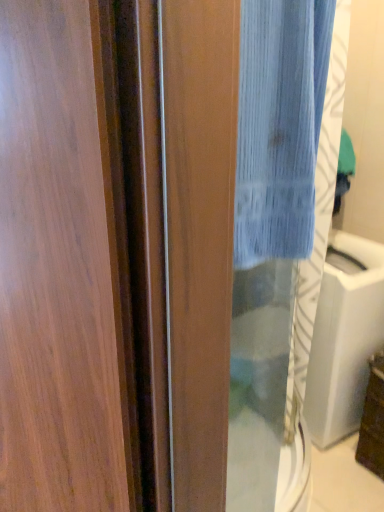
Locate an element on the screen. transparent glass sink at center is located at coordinates (344, 337).

Is there a large distance between wooden screen door at left and blue textured fabric at center?

No, there isn't a large distance between wooden screen door at left and blue textured fabric at center.

Can you confirm if wooden screen door at left is shorter than blue textured fabric at center?

In fact, wooden screen door at left may be taller than blue textured fabric at center.

Which is behind, point (322, 193) or point (274, 45)?

The point (322, 193) is farther from the camera.

From the image's perspective, is blue textured fabric at center on wooden screen door at left?

Yes.

In terms of width, does blue textured fabric at center look wider or thinner when compared to wooden screen door at left?

In the image, blue textured fabric at center appears to be more narrow than wooden screen door at left.

From a real-world perspective, which object rests below the other?

wooden screen door at left, from a real-world perspective.

Does blue textured fabric at center have a smaller size compared to wooden screen door at left?

Yes.

From the image's perspective, is transparent glass sink at center beneath blue textured fabric at center?

Yes, from the image's perspective, transparent glass sink at center is beneath blue textured fabric at center.

Does transparent glass sink at center have a smaller size compared to blue textured fabric at center?

No, transparent glass sink at center is not smaller than blue textured fabric at center.

Can you confirm if transparent glass sink at center is shorter than blue textured fabric at center?

No.

This screenshot has height=512, width=384. In the image, there is a blue textured fabric at center. In order to click on sink below it (from the image's perspective) in this screenshot , I will do `click(344, 337)`.

Would you say blue textured fabric at center is a long distance from transparent glass sink at center?

That's not correct — blue textured fabric at center is a little close to transparent glass sink at center.

Between blue textured fabric at center and transparent glass sink at center, which one appears on the right side from the viewer's perspective?

transparent glass sink at center is more to the right.

Are wooden screen door at left and transparent glass sink at center making contact?

No, wooden screen door at left is not with transparent glass sink at center.

Considering the relative positions of wooden screen door at left and transparent glass sink at center in the image provided, is wooden screen door at left to the left of transparent glass sink at center from the viewer's perspective?

Yes.

What's the angular difference between transparent glass sink at center and wooden screen door at left's facing directions?

7.71 degrees separate the facing orientations of transparent glass sink at center and wooden screen door at left.

Is transparent glass sink at center looking in the opposite direction of wooden screen door at left?

transparent glass sink at center is not turned away from wooden screen door at left.

Is point (313, 393) farther from camera compared to point (199, 329)?

Yes, it is.

Find the location of a particular element. This screenshot has width=384, height=512. screen door on the left of the transparent glass sink at center is located at coordinates (245, 239).

Where is `curtain on the right of the wooden screen door at left`? This screenshot has width=384, height=512. curtain on the right of the wooden screen door at left is located at coordinates (279, 126).

At what (x,y) coordinates should I click in order to perform the action: click on screen door that appears below the blue textured fabric at center (from a real-world perspective). Please return your answer as a coordinate pair (x, y). The width and height of the screenshot is (384, 512). Looking at the image, I should click on (245, 239).

When comparing their distances from wooden screen door at left, does transparent glass sink at center or blue textured fabric at center seem further?

blue textured fabric at center.

Which object lies nearer to the anchor point transparent glass sink at center, wooden screen door at left or blue textured fabric at center?

wooden screen door at left is positioned closer to the anchor transparent glass sink at center.

Based on the photo, based on their spatial positions, is wooden screen door at left or transparent glass sink at center closer to blue textured fabric at center?

wooden screen door at left.

Considering their positions, is blue textured fabric at center positioned further to transparent glass sink at center than wooden screen door at left?

blue textured fabric at center is further to transparent glass sink at center.

Based on their spatial positions, is transparent glass sink at center or wooden screen door at left closer to blue textured fabric at center?

wooden screen door at left is positioned closer to the anchor blue textured fabric at center.

Looking at this image, estimate the real-world distances between objects in this image. Which object is closer to wooden screen door at left, blue textured fabric at center or transparent glass sink at center?

The object closer to wooden screen door at left is transparent glass sink at center.

What are the coordinates of `screen door positioned between blue textured fabric at center and transparent glass sink at center from near to far` in the screenshot? It's located at (245, 239).